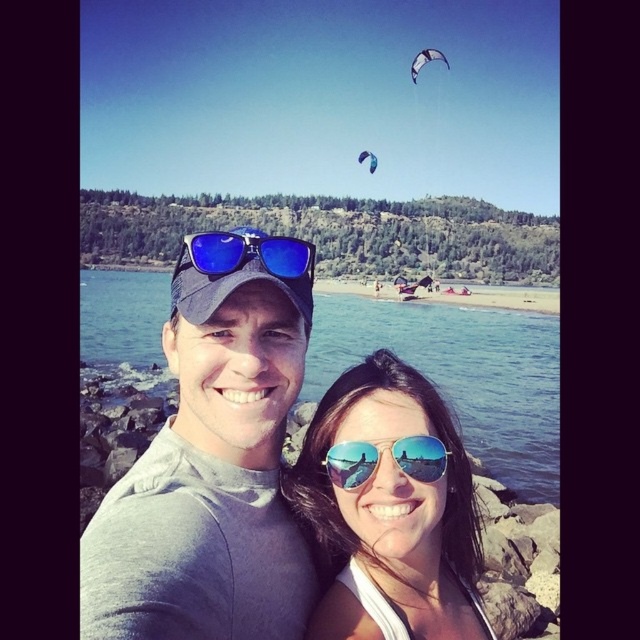
Is gold reflective sunglasses at center further to camera compared to white fabric kite at upper center?

No, it is in front of white fabric kite at upper center.

Which of these two, gold reflective sunglasses at center or white fabric kite at upper center, stands taller?

With more height is white fabric kite at upper center.

Measure the distance between point (360, 472) and camera.

35.71 meters

At what (x,y) coordinates should I click in order to perform the action: click on gold reflective sunglasses at center. Please return your answer as a coordinate pair (x, y). Image resolution: width=640 pixels, height=640 pixels. Looking at the image, I should click on (380, 460).

Does point (513, 472) come in front of point (376, 164)?

Yes, point (513, 472) is in front of point (376, 164).

Is point (154, 356) farther from camera compared to point (364, 156)?

No, (154, 356) is closer to viewer.

Identify the location of clear blue water at center. (460, 374).

Which is in front, point (227, 460) or point (540, 324)?

Point (227, 460) is more forward.

This screenshot has height=640, width=640. What do you see at coordinates (212, 465) in the screenshot?
I see `gray matte t-shirt at center` at bounding box center [212, 465].

Is point (234, 275) more distant than point (536, 468)?

No, (234, 275) is closer to viewer.

In order to click on gray matte t-shirt at center in this screenshot , I will do `click(212, 465)`.